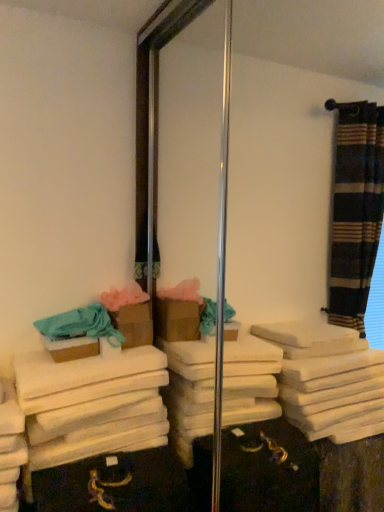
Question: Considering the relative sizes of brown cardboard box at center, positioned as the 2th box in back-to-front order, and teal cotton bath towel at left, which is the first bath towel from top to bottom, in the image provided, is brown cardboard box at center, positioned as the 2th box in back-to-front order, taller than teal cotton bath towel at left, which is the first bath towel from top to bottom,?

Choices:
 (A) yes
 (B) no

Answer: (B)

Question: Is brown cardboard box at center, positioned as the 2th box in back-to-front order, behind teal cotton bath towel at left, marked as the second bath towel in a bottom-to-top arrangement?

Choices:
 (A) no
 (B) yes

Answer: (B)

Question: From the image's perspective, would you say brown cardboard box at center, positioned as the 2th box in back-to-front order, is shown under teal cotton bath towel at left, marked as the second bath towel in a bottom-to-top arrangement?

Choices:
 (A) yes
 (B) no

Answer: (A)

Question: Considering the relative sizes of brown cardboard box at center, positioned as the 2th box in back-to-front order, and teal cotton bath towel at left, marked as the second bath towel in a bottom-to-top arrangement, in the image provided, is brown cardboard box at center, positioned as the 2th box in back-to-front order, bigger than teal cotton bath towel at left, marked as the second bath towel in a bottom-to-top arrangement,?

Choices:
 (A) yes
 (B) no

Answer: (B)

Question: Does brown cardboard box at center, the 1th box from the front, come in front of teal cotton bath towel at left, which is the first bath towel from top to bottom?

Choices:
 (A) yes
 (B) no

Answer: (B)

Question: Would you say brown cardboard box at center, positioned as the 2th box in back-to-front order, is inside or outside teal cotton bath towel at left, which is the first bath towel from top to bottom?

Choices:
 (A) outside
 (B) inside

Answer: (B)

Question: Would you say brown cardboard box at center, positioned as the 2th box in back-to-front order, is to the left or to the right of teal cotton bath towel at left, marked as the second bath towel in a bottom-to-top arrangement, in the picture?

Choices:
 (A) right
 (B) left

Answer: (B)

Question: Considering the positions of brown cardboard box at center, the 1th box from the front, and teal cotton bath towel at left, which is the first bath towel from top to bottom, in the image, is brown cardboard box at center, the 1th box from the front, wider or thinner than teal cotton bath towel at left, which is the first bath towel from top to bottom,?

Choices:
 (A) wide
 (B) thin

Answer: (B)

Question: From their relative heights in the image, would you say brown cardboard box at center, positioned as the 2th box in back-to-front order, is taller or shorter than teal cotton bath towel at left, marked as the second bath towel in a bottom-to-top arrangement?

Choices:
 (A) tall
 (B) short

Answer: (B)

Question: Based on their positions, is brown cardboard box at left, which is the 2th box in front-to-back order, located to the left or right of teal cotton bath towel at left, which is the first bath towel from top to bottom?

Choices:
 (A) left
 (B) right

Answer: (B)

Question: Is point (117, 313) positioned closer to the camera than point (77, 332)?

Choices:
 (A) farther
 (B) closer

Answer: (A)

Question: Is brown cardboard box at left, which is the 2th box in front-to-back order, inside or outside of teal cotton bath towel at left, marked as the second bath towel in a bottom-to-top arrangement?

Choices:
 (A) outside
 (B) inside

Answer: (A)

Question: From the image's perspective, is brown cardboard box at left, marked as the 1th box in a back-to-front arrangement, above or below teal cotton bath towel at left, marked as the second bath towel in a bottom-to-top arrangement?

Choices:
 (A) above
 (B) below

Answer: (A)

Question: Choose the correct answer: Is white soft towel at lower left, the 2th bath towel from the top, inside teal cotton bath towel at left, which is the first bath towel from top to bottom, or outside it?

Choices:
 (A) inside
 (B) outside

Answer: (B)

Question: Based on their sizes in the image, would you say white soft towel at lower left, marked as the first bath towel in a bottom-to-top arrangement, is bigger or smaller than teal cotton bath towel at left, which is the first bath towel from top to bottom?

Choices:
 (A) big
 (B) small

Answer: (A)